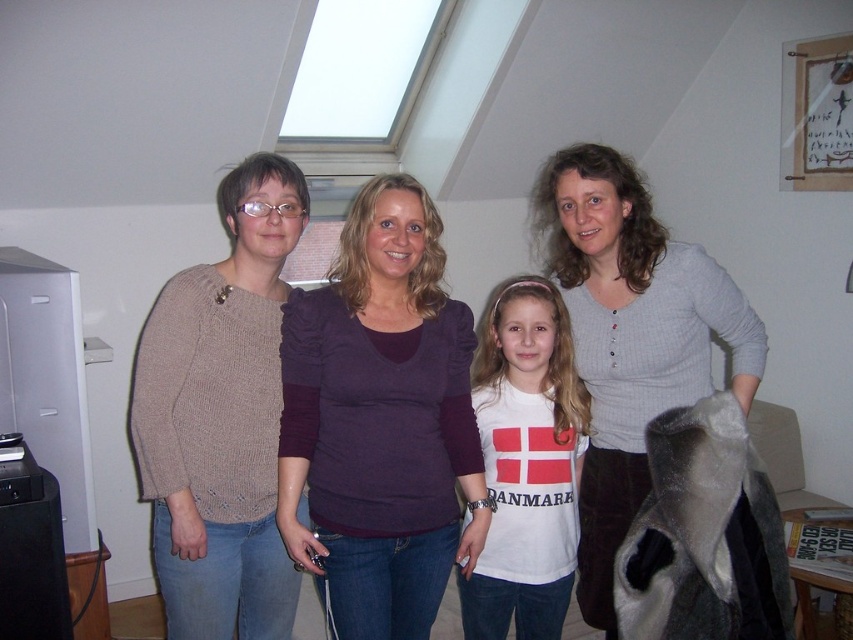
You are designing a clothing display in a store and need to place the knitted beige sweater at left and the matte purple sweater at center on a mannequin. Which sweater should you choose if you want the one that is narrower?

The knitted beige sweater at left is narrower than the matte purple sweater at center, so you should choose the knitted beige sweater at left for the display.

You are planning to buy a new outfit and want to match the size of your current clothes. You have the purple soft fabric shirt at center and the knitted beige sweater at left. Which one should you choose if you need a smaller size?

The purple soft fabric shirt at center has a smaller size compared to knitted beige sweater at left, so you should choose the purple soft fabric shirt at center.